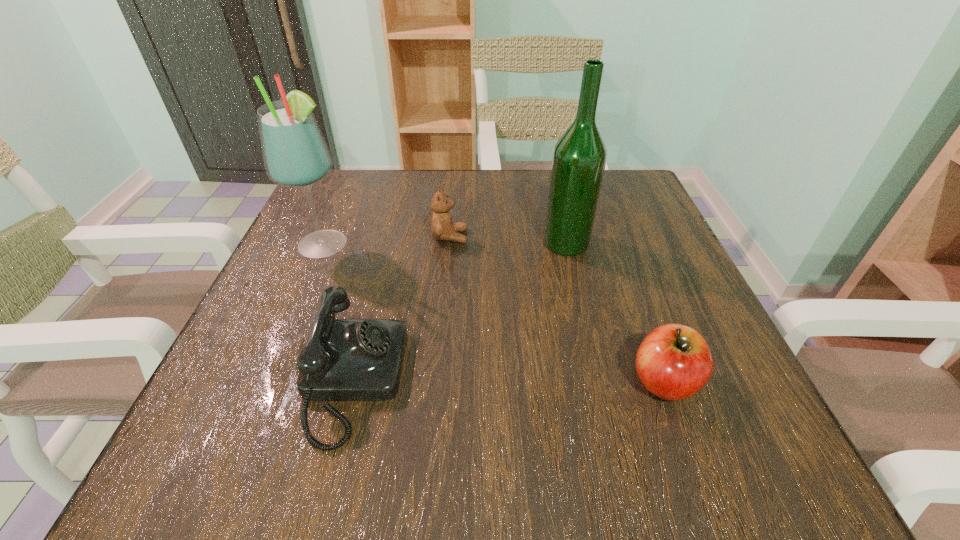
Image resolution: width=960 pixels, height=540 pixels. What are the coordinates of `vacant space at the far left corner of the desktop` in the screenshot? It's located at (378, 172).

Identify the location of vacant space at the far right corner of the desktop. The width and height of the screenshot is (960, 540). (616, 208).

Locate an element on the screen. free spot at the near right corner of the desktop is located at coordinates (725, 443).

Where is `blank region between the right alcohol and the telephone`? Image resolution: width=960 pixels, height=540 pixels. blank region between the right alcohol and the telephone is located at coordinates (460, 312).

Image resolution: width=960 pixels, height=540 pixels. I want to click on vacant area that lies between the apple and the telephone, so click(x=509, y=381).

In order to click on free space that is in between the left alcohol and the telephone in this screenshot , I will do click(339, 313).

At what (x,y) coordinates should I click in order to perform the action: click on free space between the right alcohol and the apple. Please return your answer as a coordinate pair (x, y). Looking at the image, I should click on (614, 312).

Identify the location of vacant space in between the apple and the teddy bear. (557, 309).

You are a GUI agent. You are given a task and a screenshot of the screen. Output one action in this format:
    pyautogui.click(x=<x>, y=<y>)
    Task: Click on the free spot between the left alcohol and the right alcohol
    
    Given the screenshot: What is the action you would take?
    pyautogui.click(x=445, y=244)

Locate an element on the screen. The image size is (960, 540). free space between the left alcohol and the apple is located at coordinates (494, 313).